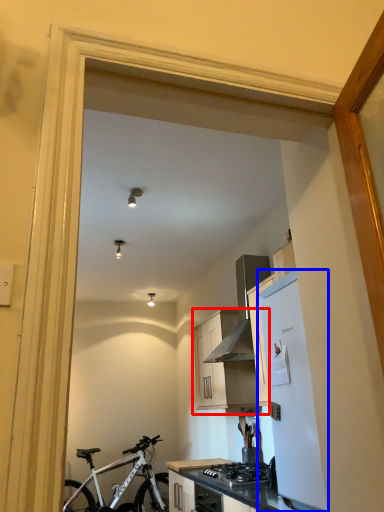
Question: Which object appears closest to the camera in this image, cabinetry (highlighted by a red box) or refrigerator (highlighted by a blue box)?

Choices:
 (A) cabinetry
 (B) refrigerator

Answer: (B)